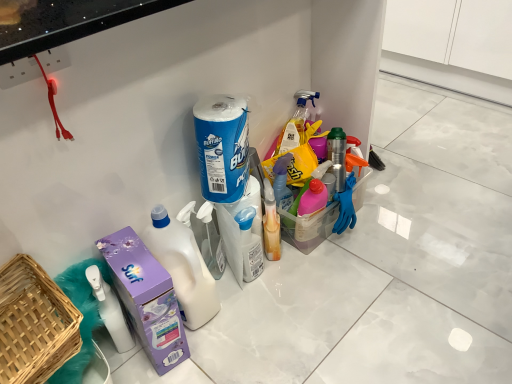
Image resolution: width=512 pixels, height=384 pixels. Describe the element at coordinates (183, 267) in the screenshot. I see `white plastic bottle at center` at that location.

Locate an element on the screen. white plastic spray bottle at center, which ranks as the first cleaning product in bottom-to-top order is located at coordinates (250, 244).

The width and height of the screenshot is (512, 384). Identify the location of white plastic bottle at center. [x=183, y=267].

Does woven wood basket at lower left touch white plastic bottle at center?

They are not placed beside each other.

Is woven wood basket at lower left looking in the opposite direction of white plastic bottle at center?

No, woven wood basket at lower left's orientation is not away from white plastic bottle at center.

Does woven wood basket at lower left have a greater width compared to white plastic bottle at center?

Yes.

Considering the sizes of woven wood basket at lower left and white plastic bottle at center in the image, is woven wood basket at lower left taller or shorter than white plastic bottle at center?

Clearly, woven wood basket at lower left is shorter compared to white plastic bottle at center.

Is white plastic bottle at center bigger than woven wood basket at lower left?

No.

Which object is positioned more to the right, white plastic bottle at center or woven wood basket at lower left?

Positioned to the right is white plastic bottle at center.

This screenshot has height=384, width=512. I want to click on bottle to the right of woven wood basket at lower left, so click(183, 267).

Can we say white plastic bottle at center lies outside woven wood basket at lower left?

Yes, white plastic bottle at center is outside of woven wood basket at lower left.

This screenshot has height=384, width=512. I want to click on bottle that is below the white plastic spray bottle at center, which is the 2th cleaning product from top to bottom (from the image's perspective), so click(183, 267).

Is white plastic spray bottle at center, which is the 2th cleaning product from top to bottom, beside white plastic bottle at center?

They are not placed beside each other.

Which is nearer, [246,271] or [191,322]?

The point [191,322] is more forward.

From the picture: Considering the relative sizes of white plastic spray bottle at center, which ranks as the first cleaning product in bottom-to-top order, and white plastic bottle at center in the image provided, is white plastic spray bottle at center, which ranks as the first cleaning product in bottom-to-top order, bigger than white plastic bottle at center?

No, white plastic spray bottle at center, which ranks as the first cleaning product in bottom-to-top order, is not bigger than white plastic bottle at center.

Does woven wood basket at lower left lie in front of blue paper towel roll at center, which is the first cleaning product from top to bottom?

Yes, woven wood basket at lower left is closer to the viewer.

Is woven wood basket at lower left next to blue paper towel roll at center, the second cleaning product from the bottom, and touching it?

No.

Does point (11, 374) lie behind point (213, 105)?

No, it is not.

Is woven wood basket at lower left thinner than blue paper towel roll at center, which is the first cleaning product from top to bottom?

Incorrect, the width of woven wood basket at lower left is not less than that of blue paper towel roll at center, which is the first cleaning product from top to bottom.

What's the angular difference between purple cardboard carton at lower left and blue paper towel roll at center, which is the first cleaning product from top to bottom,'s facing directions?

The facing directions of purple cardboard carton at lower left and blue paper towel roll at center, which is the first cleaning product from top to bottom, are 10.8 degrees apart.

Which is nearer, (131, 263) or (234, 112)?

Positioned in front is point (131, 263).

From a real-world perspective, between purple cardboard carton at lower left and blue paper towel roll at center, which is the first cleaning product from top to bottom, who is vertically lower?

purple cardboard carton at lower left, from a real-world perspective.

Can blue paper towel roll at center, which is the first cleaning product from top to bottom, be found inside purple cardboard carton at lower left?

No, blue paper towel roll at center, which is the first cleaning product from top to bottom, is not inside purple cardboard carton at lower left.

Is white plastic bottle at center smaller than purple cardboard carton at lower left?

Yes.

Do you think white plastic bottle at center is within purple cardboard carton at lower left, or outside of it?

white plastic bottle at center exists outside the volume of purple cardboard carton at lower left.

Is white plastic bottle at center oriented towards purple cardboard carton at lower left?

No, white plastic bottle at center is not facing towards purple cardboard carton at lower left.

In terms of height, does purple cardboard carton at lower left look taller or shorter compared to white plastic spray bottle at center, which is the 2th cleaning product from top to bottom?

Considering their sizes, purple cardboard carton at lower left has more height than white plastic spray bottle at center, which is the 2th cleaning product from top to bottom.

Which is in front, purple cardboard carton at lower left or white plastic spray bottle at center, which is the 2th cleaning product from top to bottom?

Positioned in front is purple cardboard carton at lower left.

Could you tell me if purple cardboard carton at lower left is turned towards white plastic spray bottle at center, which is the 2th cleaning product from top to bottom?

No, purple cardboard carton at lower left does not turn towards white plastic spray bottle at center, which is the 2th cleaning product from top to bottom.

Which of these two, purple cardboard carton at lower left or white plastic spray bottle at center, which is the 2th cleaning product from top to bottom, is bigger?

Bigger between the two is purple cardboard carton at lower left.

I want to click on basket above the white plastic bottle at center (from a real-world perspective), so click(34, 323).

Find the location of `bottle above the woven wood basket at lower left (from the image's perspective)`. bottle above the woven wood basket at lower left (from the image's perspective) is located at coordinates (183, 267).

Based on the photo, based on their spatial positions, is white plastic bottle at center or white plastic spray bottle at center, which is the 2th cleaning product from top to bottom, closer to woven wood basket at lower left?

white plastic bottle at center is positioned closer to the anchor woven wood basket at lower left.

Estimate the real-world distances between objects in this image. Which object is closer to blue paper towel roll at center, the second cleaning product from the bottom, white plastic bottle at center or woven wood basket at lower left?

white plastic bottle at center.

Which object lies further to the anchor point blue paper towel roll at center, the second cleaning product from the bottom, purple cardboard carton at lower left or woven wood basket at lower left?

woven wood basket at lower left lies further to blue paper towel roll at center, the second cleaning product from the bottom, than the other object.

From the picture: Estimate the real-world distances between objects in this image. Which object is closer to purple cardboard carton at lower left, woven wood basket at lower left or blue paper towel roll at center, the second cleaning product from the bottom?

Based on the image, woven wood basket at lower left appears to be nearer to purple cardboard carton at lower left.

Looking at this image, when comparing their distances from woven wood basket at lower left, does blue paper towel roll at center, the second cleaning product from the bottom, or purple cardboard carton at lower left seem further?

blue paper towel roll at center, the second cleaning product from the bottom.

When comparing their distances from white plastic bottle at center, does white plastic spray bottle at center, which is the 2th cleaning product from top to bottom, or woven wood basket at lower left seem further?

Among the two, woven wood basket at lower left is located further to white plastic bottle at center.

When comparing their distances from white plastic spray bottle at center, which ranks as the first cleaning product in bottom-to-top order, does white plastic bottle at center or woven wood basket at lower left seem closer?

The object closer to white plastic spray bottle at center, which ranks as the first cleaning product in bottom-to-top order, is white plastic bottle at center.

Which object lies further to the anchor point white plastic bottle at center, blue paper towel roll at center, the second cleaning product from the bottom, or white plastic spray bottle at center, which is the 2th cleaning product from top to bottom?

Among the two, blue paper towel roll at center, the second cleaning product from the bottom, is located further to white plastic bottle at center.

Find the location of `cleaning product between woven wood basket at lower left and white plastic spray bottle at center, which is the 2th cleaning product from top to bottom, from left to right`. cleaning product between woven wood basket at lower left and white plastic spray bottle at center, which is the 2th cleaning product from top to bottom, from left to right is located at coordinates (222, 147).

Where is `carton between woven wood basket at lower left and white plastic spray bottle at center, which ranks as the first cleaning product in bottom-to-top order, from left to right`? carton between woven wood basket at lower left and white plastic spray bottle at center, which ranks as the first cleaning product in bottom-to-top order, from left to right is located at coordinates (146, 298).

I want to click on carton situated between woven wood basket at lower left and white plastic bottle at center from left to right, so click(x=146, y=298).

This screenshot has height=384, width=512. I want to click on bottle between blue paper towel roll at center, the second cleaning product from the bottom, and purple cardboard carton at lower left from top to bottom, so click(x=183, y=267).